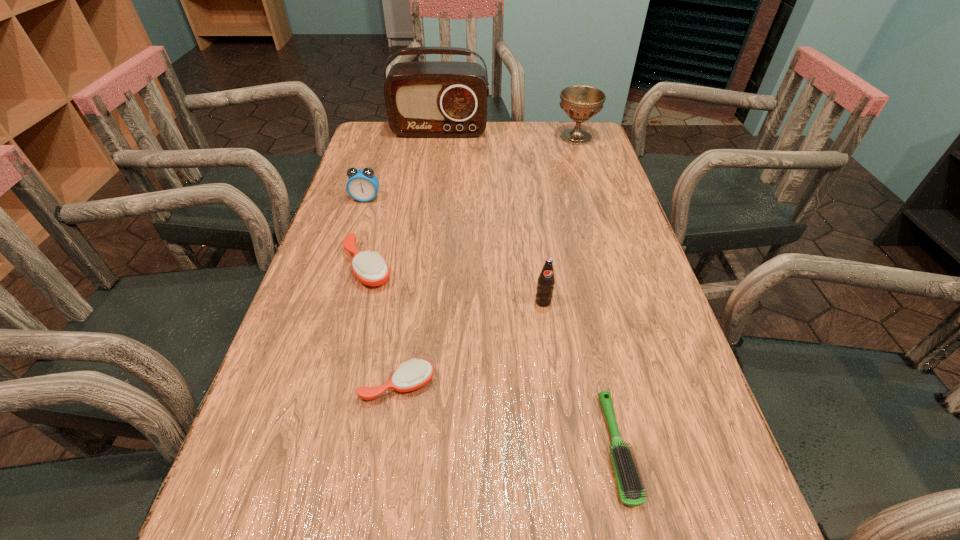
I want to click on free space at the right edge of the desktop, so click(653, 339).

In the image, there is a desktop. At what (x,y) coordinates should I click in order to perform the action: click on free space at the far left corner. Please return your answer as a coordinate pair (x, y). The height and width of the screenshot is (540, 960). Looking at the image, I should click on (410, 146).

Locate an element on the screen. Image resolution: width=960 pixels, height=540 pixels. vacant area that lies between the tallest hairbrush and the third object from right to left is located at coordinates (455, 284).

The image size is (960, 540). I want to click on empty space between the farther orange hairbrush and the smaller orange hairbrush, so click(383, 326).

This screenshot has width=960, height=540. In order to click on free spot between the fourth shortest object and the rightmost hairbrush in this screenshot , I will do coord(492,323).

Find the location of a particular element. free space between the rightmost object and the shortest hairbrush is located at coordinates (597, 293).

The height and width of the screenshot is (540, 960). What are the coordinates of `blank region between the smaller orange hairbrush and the radio receiver` in the screenshot? It's located at (419, 258).

Where is `free spot between the smaller orange hairbrush and the rightmost object`? This screenshot has width=960, height=540. free spot between the smaller orange hairbrush and the rightmost object is located at coordinates (487, 261).

I want to click on free point between the chalice and the shortest object, so click(x=597, y=293).

At what (x,y) coordinates should I click in order to perform the action: click on unoccupied position between the third object from right to left and the shortest object. Please return your answer as a coordinate pair (x, y). The height and width of the screenshot is (540, 960). Looking at the image, I should click on (581, 375).